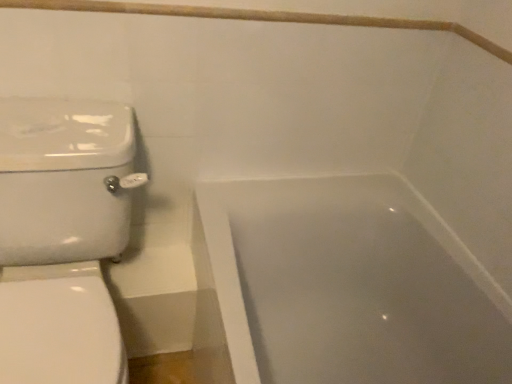
This screenshot has width=512, height=384. Describe the element at coordinates (261, 17) in the screenshot. I see `wooden balustrade at upper center` at that location.

The image size is (512, 384). What are the coordinates of `wooden balustrade at upper center` in the screenshot? It's located at (261, 17).

Identify the location of bathtub below the wooden balustrade at upper center (from the image's perspective). (343, 287).

Can you confirm if wooden balustrade at upper center is shorter than white glossy bathtub at lower right?

Correct, wooden balustrade at upper center is not as tall as white glossy bathtub at lower right.

Can you confirm if wooden balustrade at upper center is positioned to the left of white glossy bathtub at lower right?

Yes, wooden balustrade at upper center is to the left of white glossy bathtub at lower right.

Looking at this image, between wooden balustrade at upper center and white glossy bathtub at lower right, which one is positioned behind?

wooden balustrade at upper center is more distant.

Is white glossy bathtub at lower right not near white glossy toilet at left?

No, white glossy bathtub at lower right is not far away from white glossy toilet at left.

Is white glossy toilet at left at the back of white glossy bathtub at lower right?

white glossy bathtub at lower right does not have its back to white glossy toilet at left.

From a real-world perspective, is white glossy bathtub at lower right positioned above or below white glossy toilet at left?

From a real-world perspective, white glossy bathtub at lower right is physically below white glossy toilet at left.

Is white glossy bathtub at lower right located outside white glossy toilet at left?

Yes.

How far apart are white glossy bathtub at lower right and wooden balustrade at upper center?

They are 25.48 inches apart.

From the image's perspective, is white glossy bathtub at lower right above or below wooden balustrade at upper center?

From the image's perspective, white glossy bathtub at lower right appears below wooden balustrade at upper center.

Is wooden balustrade at upper center inside white glossy bathtub at lower right?

No, wooden balustrade at upper center is not surrounded by white glossy bathtub at lower right.

Which object is positioned more to the left, white glossy bathtub at lower right or wooden balustrade at upper center?

From the viewer's perspective, wooden balustrade at upper center appears more on the left side.

Is white glossy toilet at left turned away from wooden balustrade at upper center?

No.

Visually, is white glossy toilet at left positioned to the left or to the right of wooden balustrade at upper center?

From the image, it's evident that white glossy toilet at left is to the left of wooden balustrade at upper center.

Who is shorter, white glossy toilet at left or wooden balustrade at upper center?

wooden balustrade at upper center is shorter.

This screenshot has height=384, width=512. I want to click on balustrade on the right of the white glossy toilet at left, so [261, 17].

In the scene shown: Is white glossy toilet at left to the left or to the right of white glossy bathtub at lower right in the image?

white glossy toilet at left is to the left of white glossy bathtub at lower right.

Who is shorter, white glossy toilet at left or white glossy bathtub at lower right?

Standing shorter between the two is white glossy bathtub at lower right.

From the image's perspective, which one is positioned higher, white glossy toilet at left or white glossy bathtub at lower right?

white glossy toilet at left is shown above in the image.

Does wooden balustrade at upper center lie in front of white glossy toilet at left?

No, wooden balustrade at upper center is further to the viewer.

Locate an element on the screen. The width and height of the screenshot is (512, 384). balustrade above the white glossy toilet at left (from the image's perspective) is located at coordinates (261, 17).

Is wooden balustrade at upper center oriented towards white glossy toilet at left?

No, wooden balustrade at upper center does not turn towards white glossy toilet at left.

Are wooden balustrade at upper center and white glossy toilet at left located far from each other?

No, wooden balustrade at upper center is not far away from white glossy toilet at left.

The height and width of the screenshot is (384, 512). Identify the location of bathtub that appears on the right of wooden balustrade at upper center. (343, 287).

In order to click on bathtub behind the white glossy toilet at left in this screenshot , I will do `click(343, 287)`.

Looking at this image, when comparing their distances from wooden balustrade at upper center, does white glossy bathtub at lower right or white glossy toilet at left seem closer?

white glossy toilet at left is positioned closer to the anchor wooden balustrade at upper center.

Based on their spatial positions, is wooden balustrade at upper center or white glossy bathtub at lower right further from white glossy toilet at left?

white glossy bathtub at lower right lies further to white glossy toilet at left than the other object.

Looking at the image, which one is located further to wooden balustrade at upper center, white glossy toilet at left or white glossy bathtub at lower right?

Among the two, white glossy bathtub at lower right is located further to wooden balustrade at upper center.

From the image, which object appears to be nearer to white glossy toilet at left, white glossy bathtub at lower right or wooden balustrade at upper center?

wooden balustrade at upper center.

From the image, which object appears to be farther from white glossy bathtub at lower right, wooden balustrade at upper center or white glossy toilet at left?

wooden balustrade at upper center is further to white glossy bathtub at lower right.

Estimate the real-world distances between objects in this image. Which object is further from white glossy bathtub at lower right, white glossy toilet at left or wooden balustrade at upper center?

wooden balustrade at upper center lies further to white glossy bathtub at lower right than the other object.

Locate an element on the screen. This screenshot has width=512, height=384. toilet between wooden balustrade at upper center and white glossy bathtub at lower right in the vertical direction is located at coordinates (63, 236).